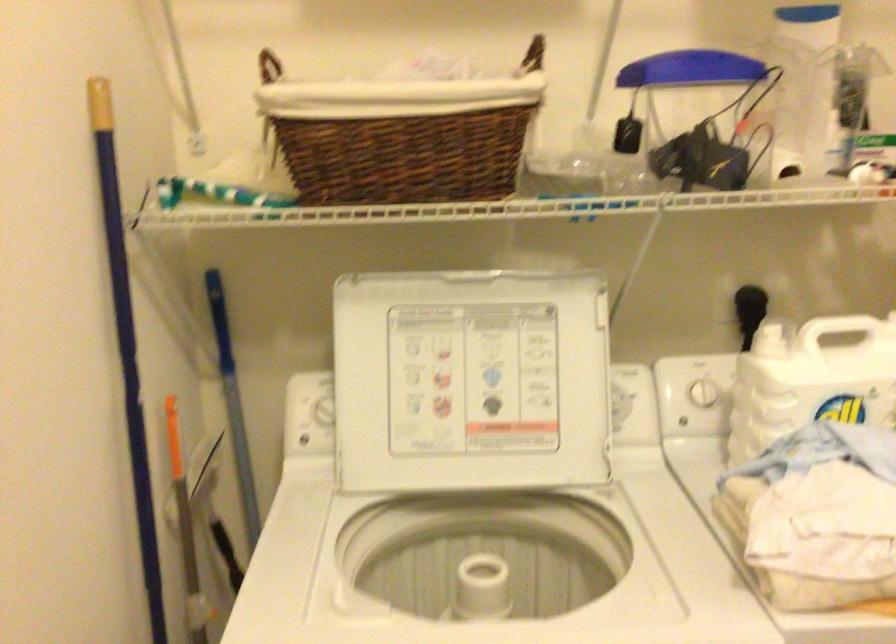
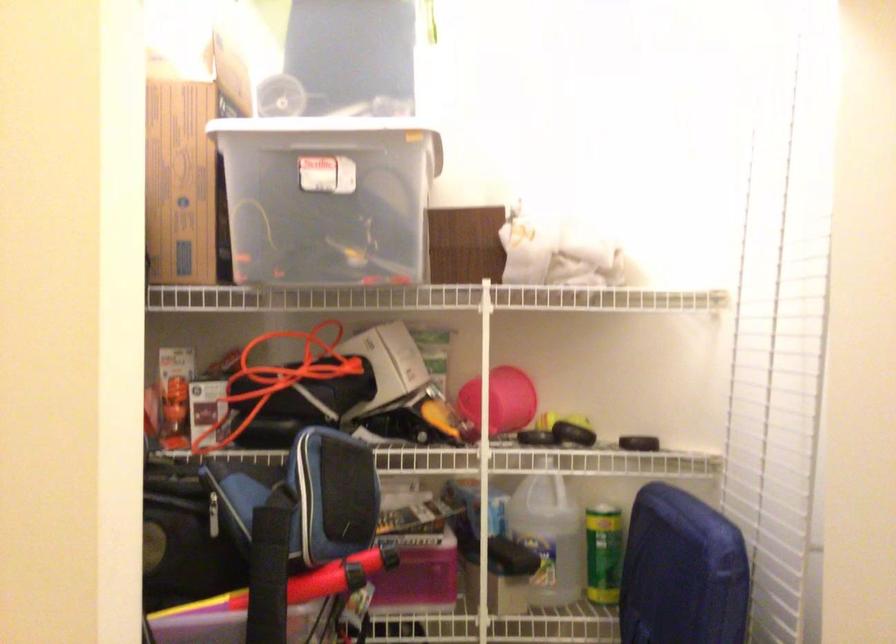
Question: The images are taken continuously from a first-person perspective. In which direction is your viewpoint rotating?

Choices:
 (A) Left
 (B) Right
 (C) Up
 (D) Down

Answer: (B)